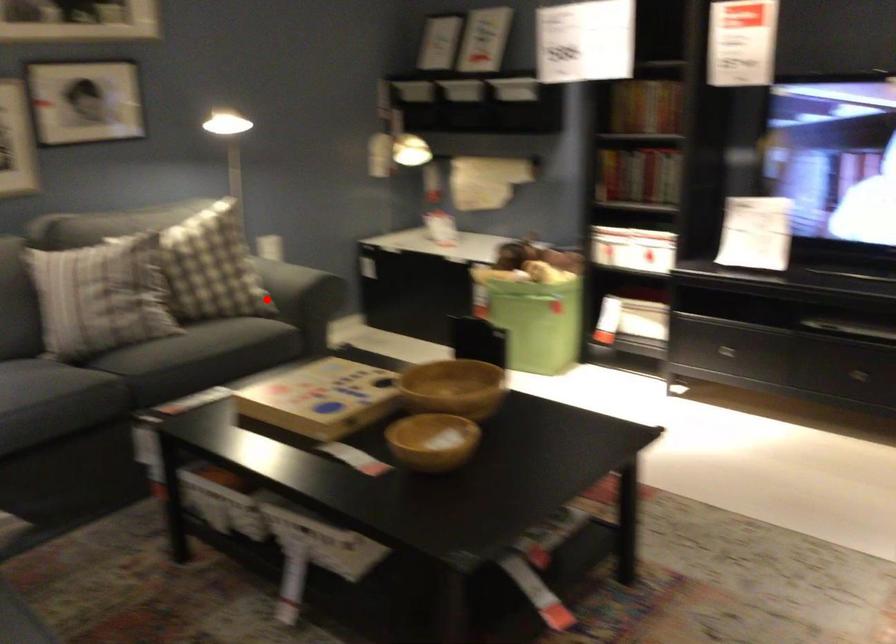
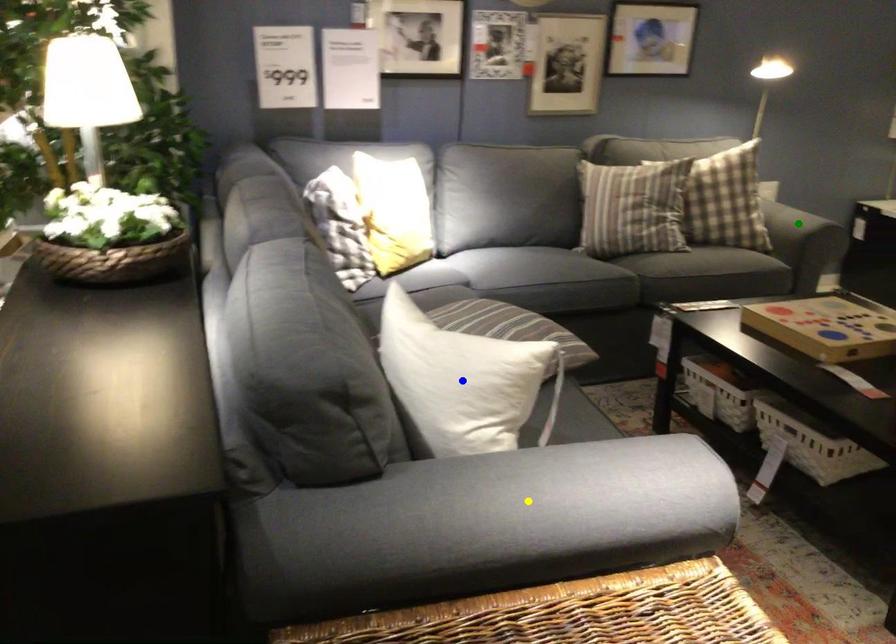
Question: I am providing you with two images of the same scene from different viewpoints. A red point is marked on the first image. You are given multiple points on the second image. Which mark in image 2 goes with the point in image 1?

Choices:
 (A) yellow point
 (B) green point
 (C) blue point

Answer: (B)